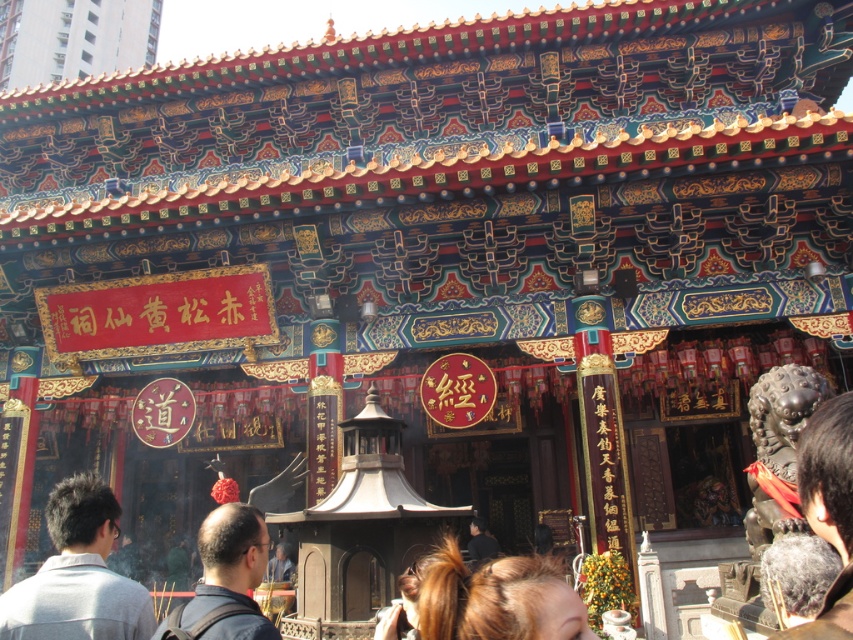
Question: Does black stone lion at lower right have a smaller size compared to dark blue fabric at center?

Choices:
 (A) no
 (B) yes

Answer: (B)

Question: Can you confirm if black stone lion at lower right is positioned above dark blue fabric at center?

Choices:
 (A) no
 (B) yes

Answer: (B)

Question: Estimate the real-world distances between objects in this image. Which object is closer to the gray fabric shirt at lower left?

Choices:
 (A) dark blue fabric at center
 (B) black stone lion at lower right

Answer: (A)

Question: Which object is farther from the camera taking this photo?

Choices:
 (A) dark blue fabric at center
 (B) gray fabric shirt at lower left

Answer: (B)

Question: Can you confirm if gray fabric shirt at lower left is positioned above black stone lion at lower right?

Choices:
 (A) yes
 (B) no

Answer: (B)

Question: Which point is farther from the camera taking this photo?

Choices:
 (A) (97, 573)
 (B) (169, 636)

Answer: (A)